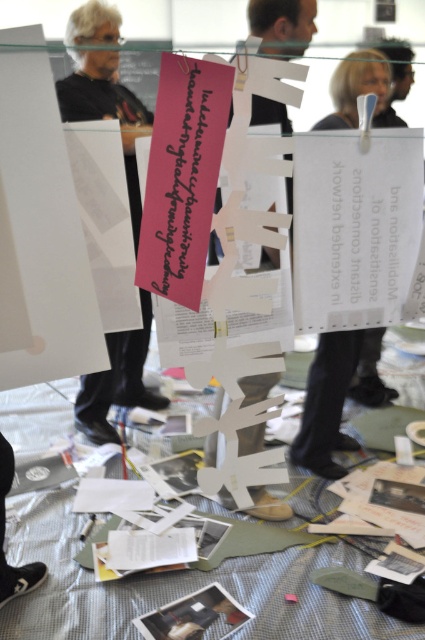
Consider the image. You are standing in the room and want to pick up the object at point (204, 452). Is it closer to you than the object at point (345, 387)?

No, point (345, 387) is closer to the camera than point (204, 452), so the object at point (204, 452) is farther away from you.

You are organizing a classroom activity and need to arrange two white papers. The white paper at upper center and the white paper at center must be placed on a shelf. Which one requires a wider space on the shelf?

The white paper at center requires a wider space on the shelf because its width is greater than the white paper at upper center.

You are an interior designer planning to hang a new decoration in the space. The existing white paper at upper center is located at coordinates point (328,403). If you want to place a new decoration 0.1 units to the right of this point, what would be the new coordinates?

The new coordinates would be 0.731, 0.772.